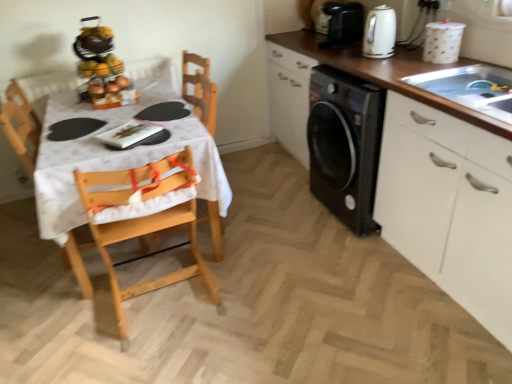
Identify the location of free space to the right of wooden highchair at left. (253, 281).